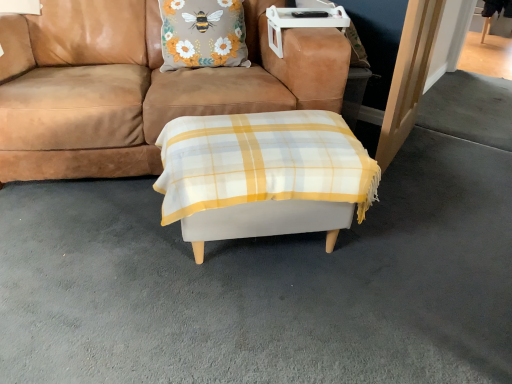
Question: Considering the positions of floral fabric pillow at upper center and white fabric ottoman at center in the image, is floral fabric pillow at upper center bigger or smaller than white fabric ottoman at center?

Choices:
 (A) small
 (B) big

Answer: (A)

Question: In the image, is floral fabric pillow at upper center positioned in front of or behind white fabric ottoman at center?

Choices:
 (A) front
 (B) behind

Answer: (B)

Question: Which object is positioned farthest from the floral fabric pillow at upper center?

Choices:
 (A) brown suede couch at center
 (B) white fabric ottoman at center

Answer: (B)

Question: Which is farther from the white fabric ottoman at center?

Choices:
 (A) brown suede couch at center
 (B) floral fabric pillow at upper center

Answer: (B)